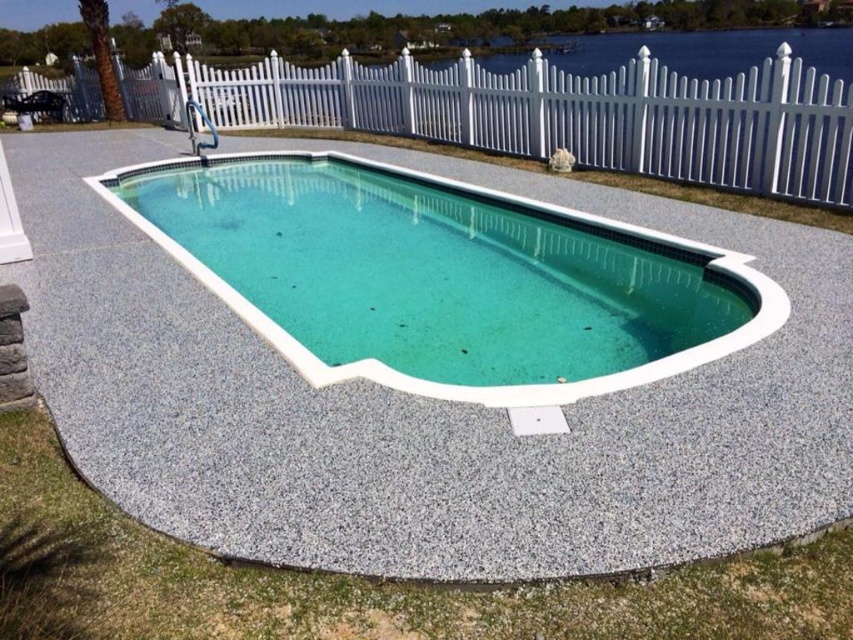
You are a painter who needs to paint the white plastic fence at upper center. You have a ladder that is 5.5 meters long. Can you safely reach the top of the fence with your ladder?

The distance between the painter and the white plastic fence at upper center is 6.10 meters. Since the ladder is only 5.5 meters long, it is not long enough to safely reach the top of the fence.

You are designing a layout for a backyard and want to place a new bench. You have two options for placement near the white plastic fence at upper center and the clear acrylic pool at center. Which location offers more space for the bench?

The white plastic fence at upper center is larger in size than the clear acrylic pool at center, so placing the bench near the white plastic fence at upper center would offer more space.